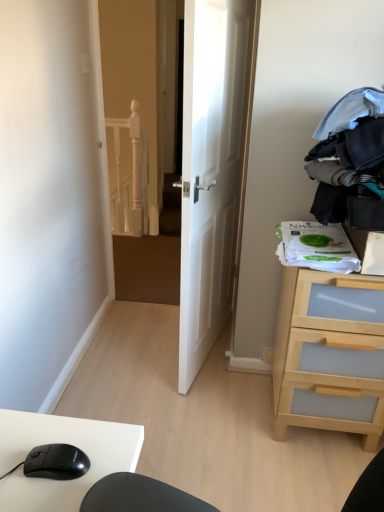
Question: From a real-world perspective, relative to dark blue fabric at upper right, is black matte mouse at lower left vertically above or below?

Choices:
 (A) above
 (B) below

Answer: (B)

Question: In the image, is black matte mouse at lower left positioned in front of or behind dark blue fabric at upper right?

Choices:
 (A) behind
 (B) front

Answer: (B)

Question: Which of these objects is positioned farthest from the light wood/transparent drawer at right?

Choices:
 (A) black matte mouse at lower left
 (B) dark blue fabric at upper right
 (C) white glossy door at center

Answer: (A)

Question: Considering the real-world distances, which object is closest to the black matte mouse at lower left?

Choices:
 (A) dark blue fabric at upper right
 (B) white glossy door at center
 (C) light wood/transparent drawer at right

Answer: (A)